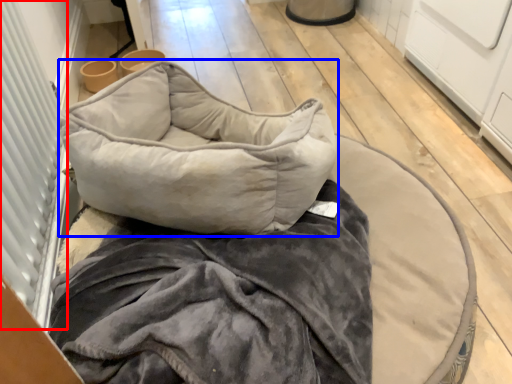
Question: Among these objects, which one is nearest to the camera, screen door (highlighted by a red box) or pillow (highlighted by a blue box)?

Choices:
 (A) screen door
 (B) pillow

Answer: (A)